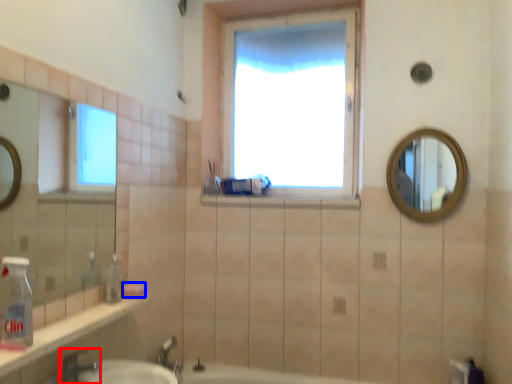
Question: Which object is further to the camera taking this photo, tap (highlighted by a red box) or soap (highlighted by a blue box)?

Choices:
 (A) tap
 (B) soap

Answer: (B)